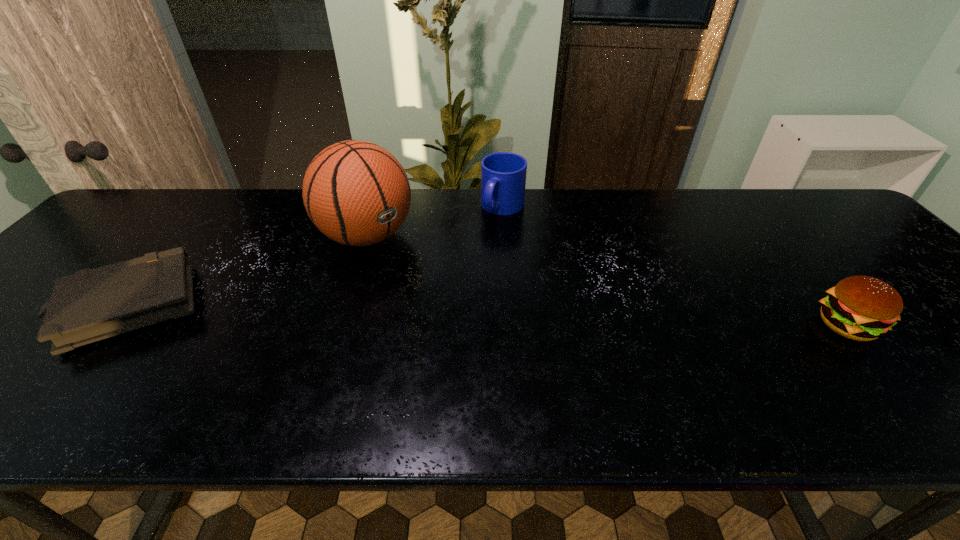
I want to click on object that is at the near left corner, so click(93, 304).

Image resolution: width=960 pixels, height=540 pixels. What are the coordinates of `blank space at the far edge of the desktop` in the screenshot? It's located at (464, 193).

Identify the location of free space at the near edge of the desktop. This screenshot has height=540, width=960. (661, 380).

Locate an element on the screen. free location at the left edge is located at coordinates (26, 305).

Where is `free space at the right edge of the desktop`? free space at the right edge of the desktop is located at coordinates (915, 348).

Locate an element on the screen. This screenshot has width=960, height=540. blank area at the far left corner is located at coordinates (169, 195).

Identify the location of free space at the far right corner of the desktop. The height and width of the screenshot is (540, 960). (812, 202).

Identify the location of unoccupied position between the Bible and the hamburger. (488, 316).

Locate an element on the screen. unoccupied position between the second shortest object and the tallest object is located at coordinates (607, 281).

Identify the location of vacant area between the hamburger and the mug. (675, 267).